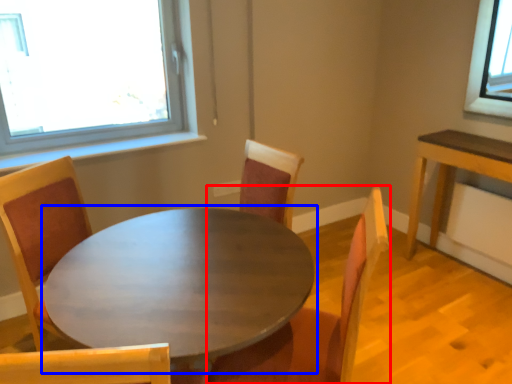
Question: Which object appears closest to the camera in this image, chair (highlighted by a red box) or coffee table (highlighted by a blue box)?

Choices:
 (A) chair
 (B) coffee table

Answer: (B)